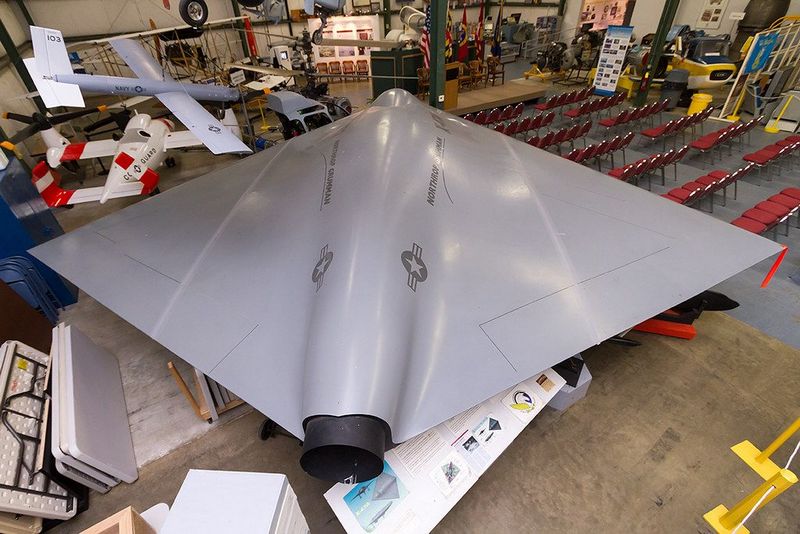
The width and height of the screenshot is (800, 534). What are the coordinates of `floor` in the screenshot? It's located at (777, 294).